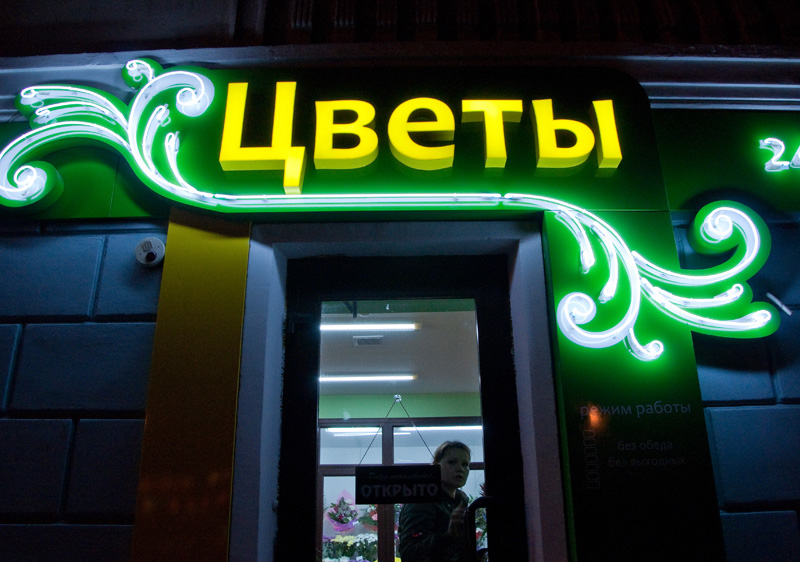
I want to click on brick wall left of entrance, so click(x=753, y=446).